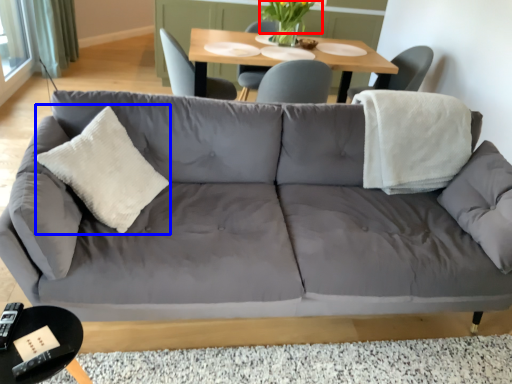
Question: Which of the following is the farthest to the observer, flower (highlighted by a red box) or throw pillow (highlighted by a blue box)?

Choices:
 (A) flower
 (B) throw pillow

Answer: (A)